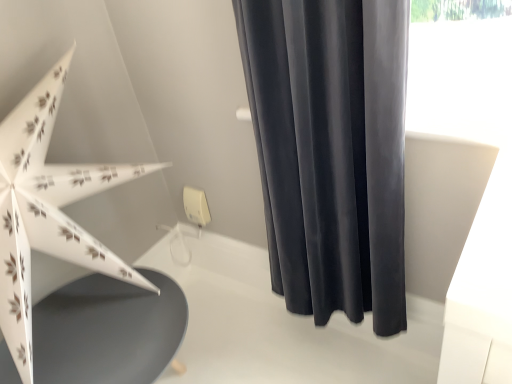
Question: Is matte gray table at lower left closer to the viewer compared to white paper umbrella at left?

Choices:
 (A) yes
 (B) no

Answer: (B)

Question: From the image's perspective, is matte gray table at lower left located above white paper umbrella at left?

Choices:
 (A) no
 (B) yes

Answer: (A)

Question: Is white paper umbrella at left inside matte gray table at lower left?

Choices:
 (A) yes
 (B) no

Answer: (B)

Question: Can you confirm if matte gray table at lower left is shorter than white paper umbrella at left?

Choices:
 (A) no
 (B) yes

Answer: (B)

Question: Is matte gray table at lower left facing away from white paper umbrella at left?

Choices:
 (A) yes
 (B) no

Answer: (B)

Question: From the image's perspective, is dark gray velvet curtain at upper right located above or below white paper umbrella at left?

Choices:
 (A) below
 (B) above

Answer: (B)

Question: Is dark gray velvet curtain at upper right spatially inside white paper umbrella at left, or outside of it?

Choices:
 (A) inside
 (B) outside

Answer: (B)

Question: Considering their positions, is dark gray velvet curtain at upper right located in front of or behind white paper umbrella at left?

Choices:
 (A) behind
 (B) front

Answer: (A)

Question: Considering the positions of point (358, 182) and point (31, 337), is point (358, 182) closer or farther from the camera than point (31, 337)?

Choices:
 (A) closer
 (B) farther

Answer: (B)

Question: Is white paper umbrella at left taller or shorter than matte gray table at lower left?

Choices:
 (A) tall
 (B) short

Answer: (A)

Question: From the image's perspective, relative to matte gray table at lower left, is white paper umbrella at left above or below?

Choices:
 (A) below
 (B) above

Answer: (B)

Question: Is white paper umbrella at left to the left or to the right of matte gray table at lower left in the image?

Choices:
 (A) right
 (B) left

Answer: (B)

Question: From a real-world perspective, is white paper umbrella at left positioned above or below matte gray table at lower left?

Choices:
 (A) below
 (B) above

Answer: (B)

Question: In terms of height, does matte gray table at lower left look taller or shorter compared to dark gray velvet curtain at upper right?

Choices:
 (A) tall
 (B) short

Answer: (B)

Question: Is matte gray table at lower left inside or outside of dark gray velvet curtain at upper right?

Choices:
 (A) outside
 (B) inside

Answer: (A)